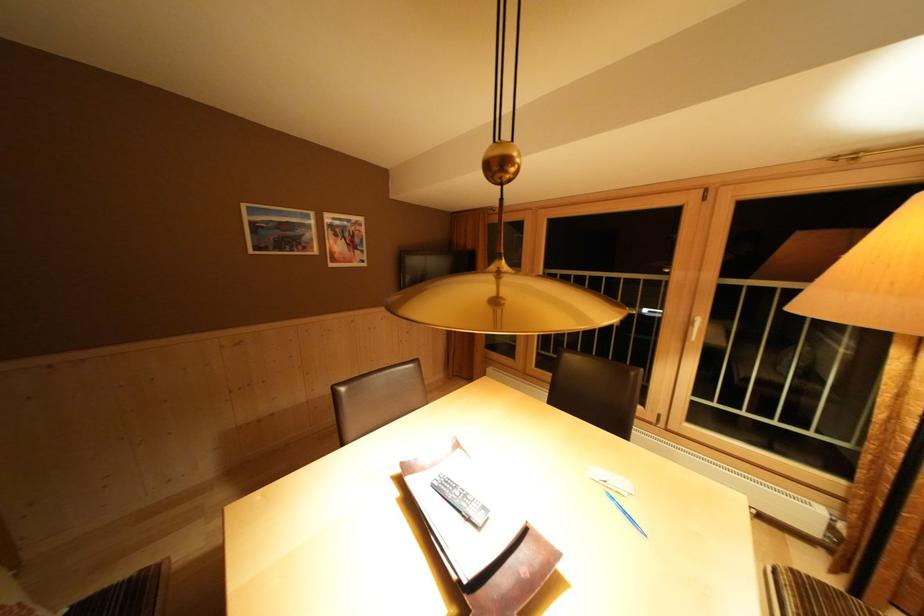
Where would you turn the white door handle? Please return your answer as a coordinate pair (x, y).

(709, 331)